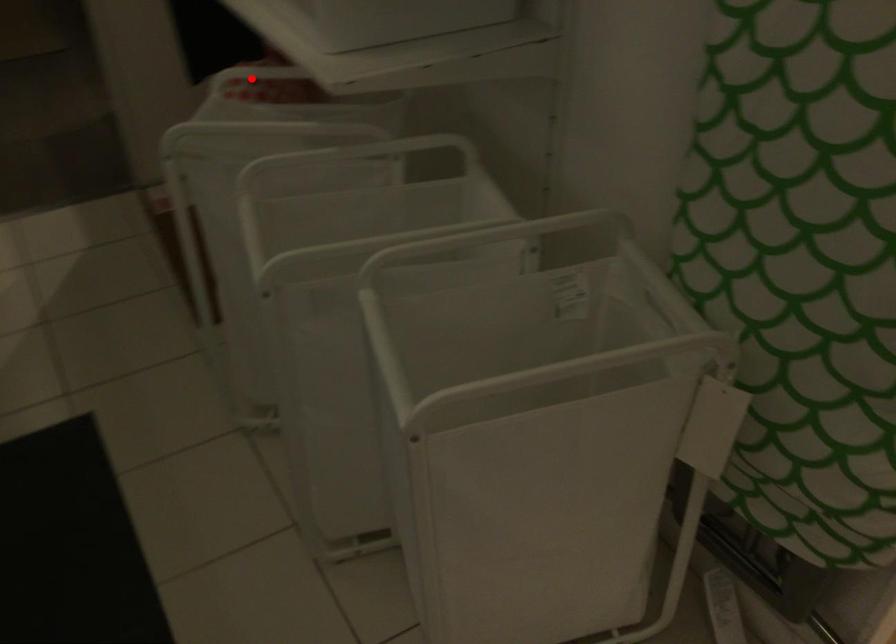
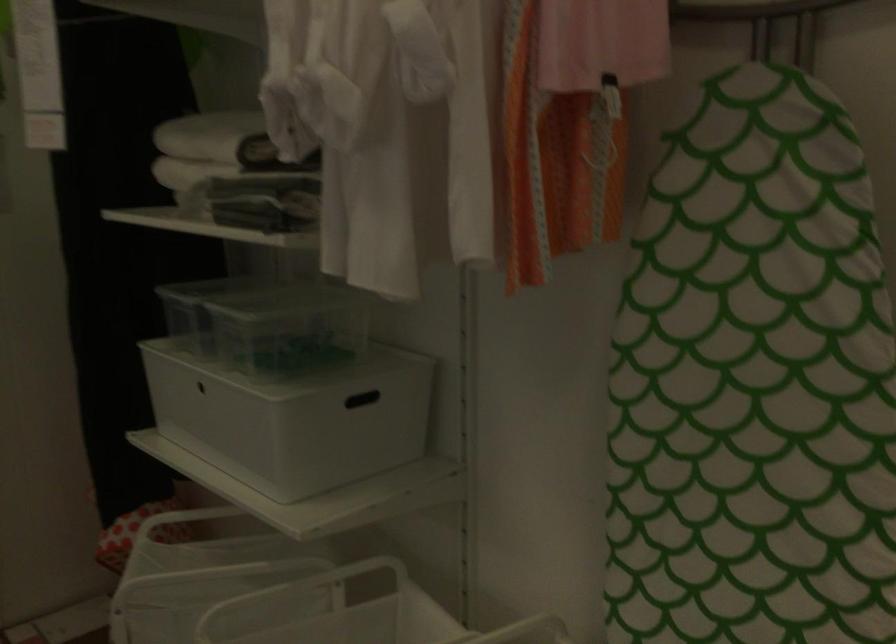
Locate, in the second image, the point that corresponds to the highlighted location in the first image.

(179, 525)